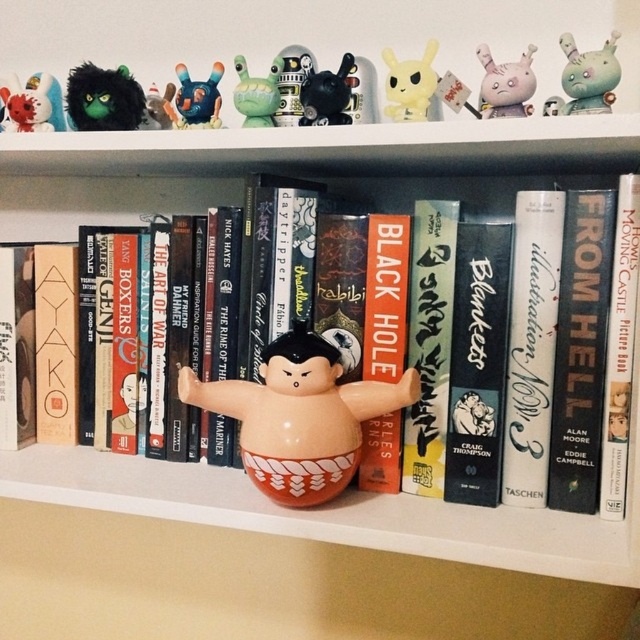
Question: Is matte plastic toy at upper right bigger than shiny black figurine at center?

Choices:
 (A) no
 (B) yes

Answer: (A)

Question: Which point appears farthest from the camera in this image?

Choices:
 (A) (333, 77)
 (B) (198, 99)
 (C) (522, 86)

Answer: (B)

Question: Considering the relative positions of yellow matte pikachu at upper center and matte green plastic toy at upper center in the image provided, where is yellow matte pikachu at upper center located with respect to matte green plastic toy at upper center?

Choices:
 (A) left
 (B) right

Answer: (B)

Question: Which point appears closest to the camera in this image?

Choices:
 (A) (26, 120)
 (B) (70, 70)
 (C) (4, 179)

Answer: (A)

Question: Which object appears closest to the camera in this image?

Choices:
 (A) shiny black figurine at center
 (B) blue rubber toy at upper center
 (C) glossy ceramic sumo wrestler at center
 (D) shiny black plush toy at upper left

Answer: (C)

Question: Is matte orange ceramic sumo wrestler at center positioned before shiny black figurine at center?

Choices:
 (A) yes
 (B) no

Answer: (A)